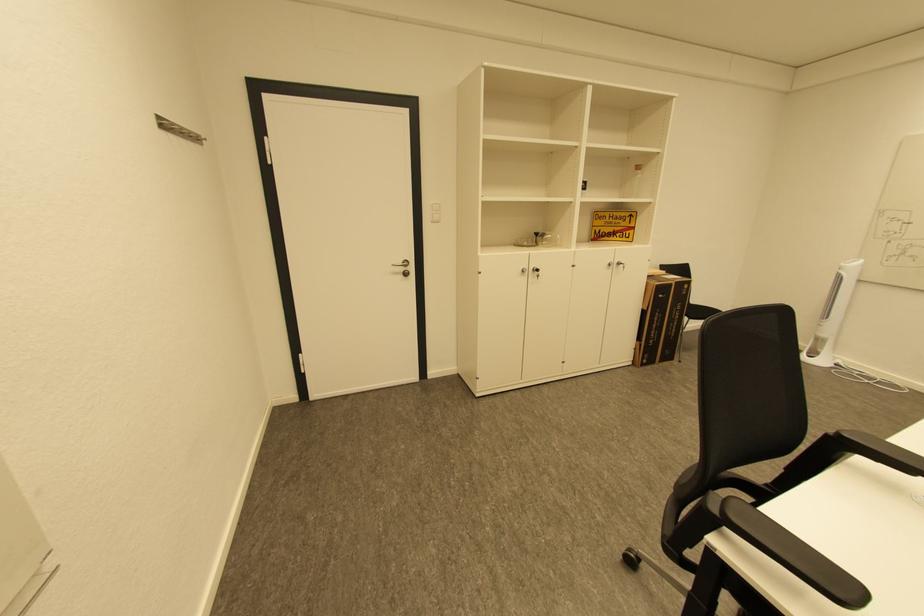
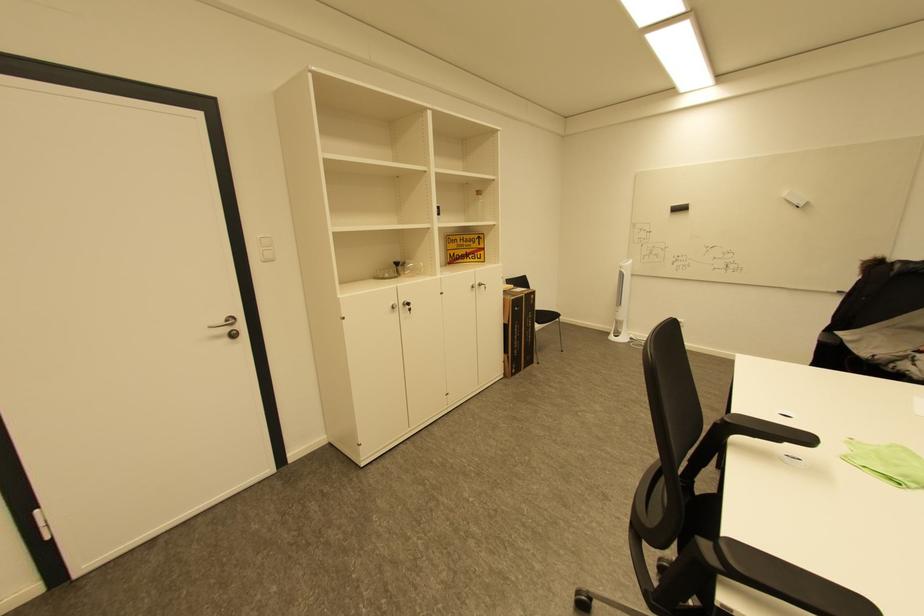
Locate, in the second image, the point that corresponds to pixel 529 272 in the first image.

(398, 308)